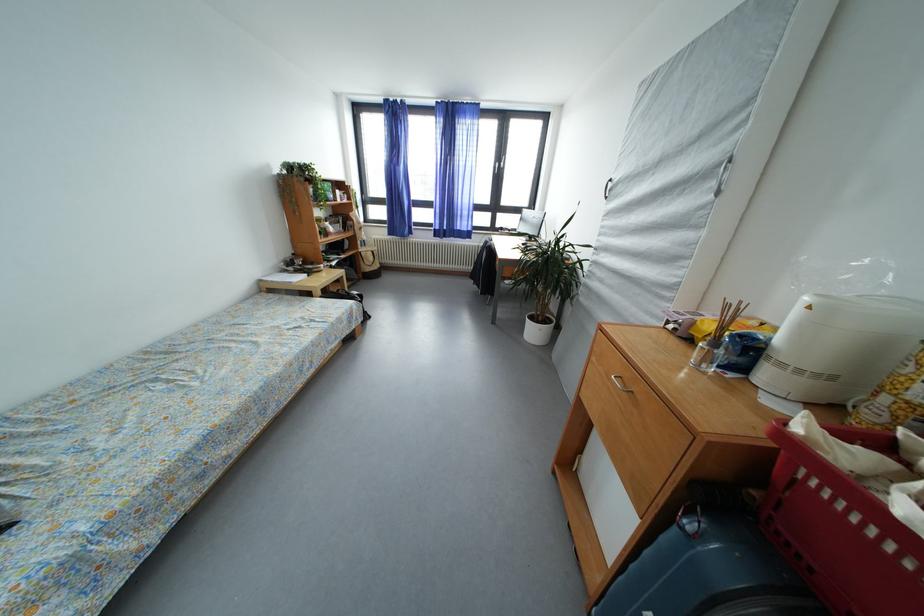
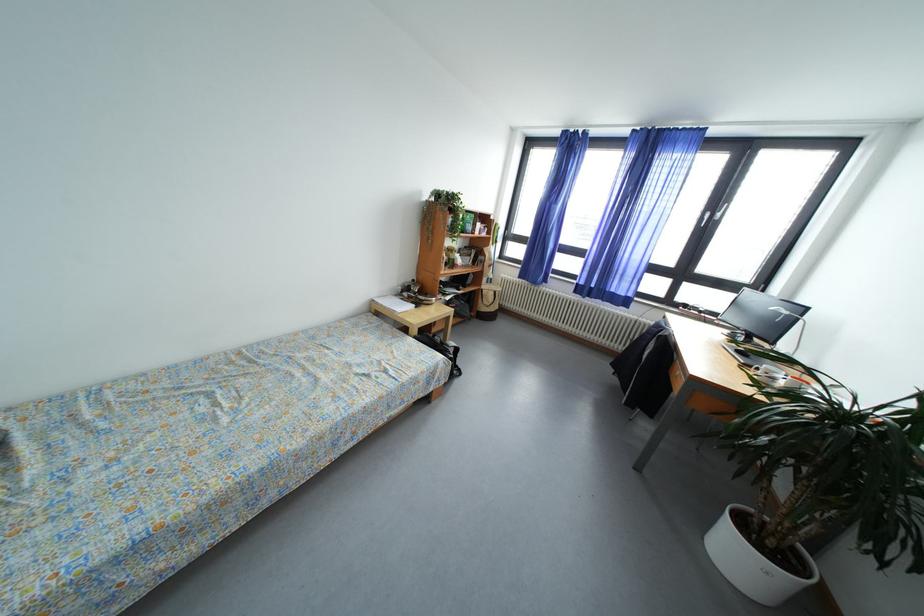
In the second image, find the point that corresponds to (x=380, y=257) in the first image.

(502, 297)